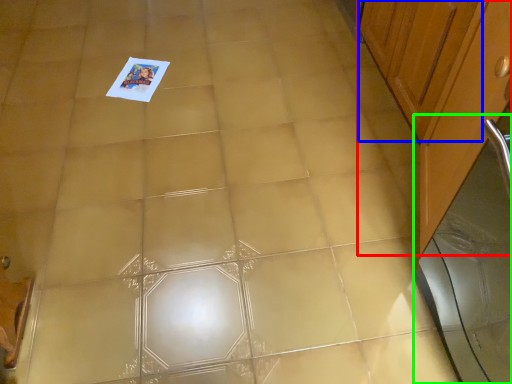
Question: Which object is the farthest from cabinetry (highlighted by a red box)? Choose among these: cabinetry (highlighted by a blue box) or screen door (highlighted by a green box).

Choices:
 (A) cabinetry
 (B) screen door

Answer: (B)